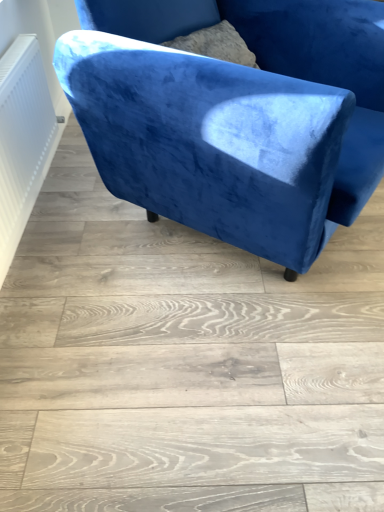
Identify the location of vacant space situated on the left part of velvet blue armchair at upper center. (69, 244).